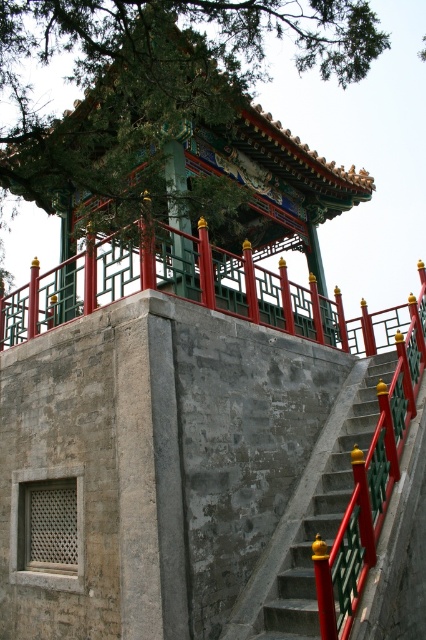
You are a visitor standing at the bottom of the concrete stairs at center. You want to take a photo of the green painted wood pillar at center from the best angle. Which object should you focus on first to ensure the pillar is fully visible in your shot?

The concrete stairs at center is bigger than green painted wood pillar at center, so you should focus on the green painted wood pillar at center first to ensure it is fully visible in your shot since it is smaller and might be easier to frame properly.

You are standing at the base of the pavilion and want to reach the entrance. You see the concrete stairs at center and the green painted wood pillar at center. Which object is positioned to the right of the other?

The concrete stairs at center are to the right of the green painted wood pillar at center.

You are standing at the base of the stone platform looking up at the pavilion. You see the green textured tree at upper center and the concrete stairs at center. Which object is closer to you from your current position?

The green textured tree at upper center is in front of the concrete stairs at center, so it is closer to you.